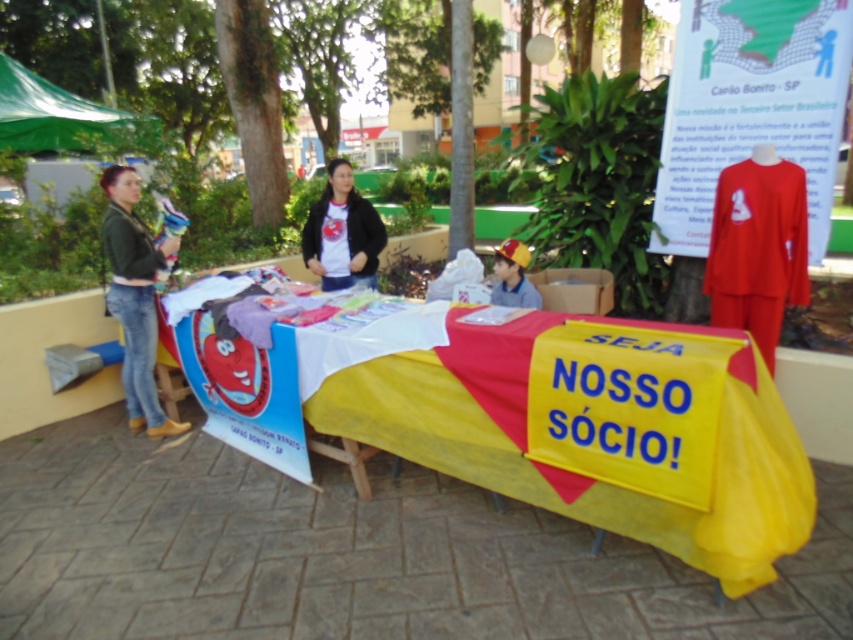
Question: Is green matte jacket at left above green fabric canopy at upper left?

Choices:
 (A) yes
 (B) no

Answer: (B)

Question: Is green matte jacket at left to the right of green fabric canopy at upper left from the viewer's perspective?

Choices:
 (A) yes
 (B) no

Answer: (A)

Question: Which point is closer to the camera?

Choices:
 (A) (589, 346)
 (B) (115, 195)

Answer: (A)

Question: Does green fabric canopy at upper left appear under matte black jacket at center?

Choices:
 (A) no
 (B) yes

Answer: (A)

Question: Which is nearer to the green matte jacket at left?

Choices:
 (A) green fabric canopy at upper left
 (B) matte black jacket at center
 (C) yellow fabric table at center

Answer: (B)

Question: Among these points, which one is farthest from the camera?

Choices:
 (A) (318, 241)
 (B) (93, 128)
 (C) (109, 221)
 (D) (775, 461)

Answer: (B)